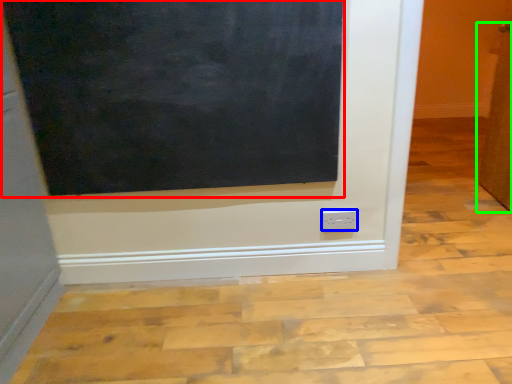
Question: Which is nearer to the bulletin board (highlighted by a red box)? power plugs and sockets (highlighted by a blue box) or door (highlighted by a green box).

Choices:
 (A) power plugs and sockets
 (B) door

Answer: (A)